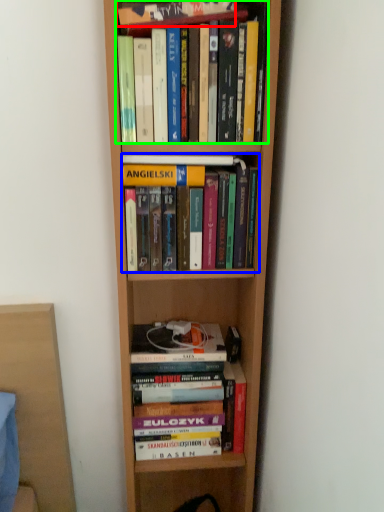
Question: Which is nearer to the book (highlighted by a red box)? book (highlighted by a blue box) or book (highlighted by a green box).

Choices:
 (A) book
 (B) book

Answer: (B)